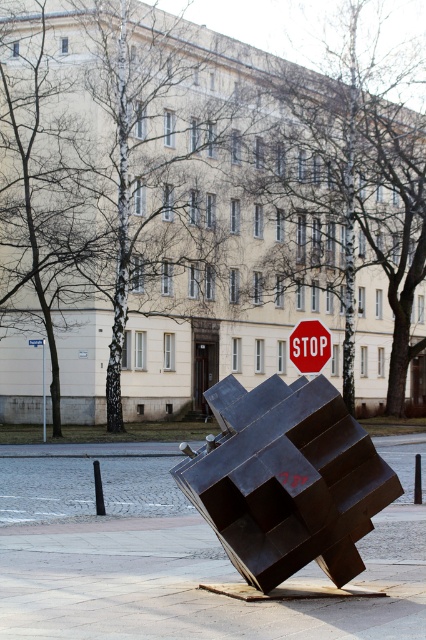
Is the position of metallic pavement at center more distant than that of red plastic stop sign at upper center?

No, metallic pavement at center is in front of red plastic stop sign at upper center.

Who is shorter, metallic pavement at center or red plastic stop sign at upper center?

red plastic stop sign at upper center is shorter.

Does point (420, 448) come in front of point (294, 340)?

That is False.

What are the coordinates of `metallic pavement at center` in the screenshot? It's located at (189, 582).

Measure the distance between red plastic stop sign at upper center and metallic street sign at upper left.

red plastic stop sign at upper center and metallic street sign at upper left are 30.63 meters apart.

How distant is red plastic stop sign at upper center from metallic street sign at upper left?

red plastic stop sign at upper center is 30.63 meters from metallic street sign at upper left.

Who is more forward, (288, 348) or (43, 420)?

Point (288, 348)

Locate an element on the screen. red plastic stop sign at upper center is located at coordinates (310, 346).

Can you confirm if metallic pavement at center is shorter than red stop sign at center?

Incorrect, metallic pavement at center's height does not fall short of red stop sign at center's.

Is metallic pavement at center wider than red stop sign at center?

Correct, the width of metallic pavement at center exceeds that of red stop sign at center.

Describe the element at coordinates (189, 582) in the screenshot. I see `metallic pavement at center` at that location.

Identify the location of metallic pavement at center. This screenshot has height=640, width=426. (189, 582).